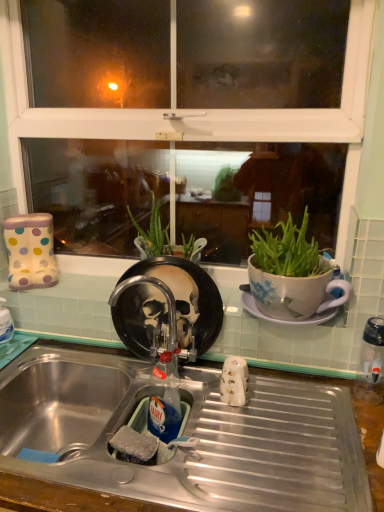
Question: Considering the positions of point (274, 433) and point (160, 397), is point (274, 433) closer or farther from the camera than point (160, 397)?

Choices:
 (A) farther
 (B) closer

Answer: (B)

Question: Looking at their shapes, would you say metallic stainless steel sink at lower center is wider or thinner than translucent plastic bottle at sink?

Choices:
 (A) wide
 (B) thin

Answer: (A)

Question: Considering the real-world distances, which object is closest to the metallic stainless steel sink at lower center?

Choices:
 (A) white ceramic saucer at right
 (B) translucent plastic bottle at sink
 (C) metallic faucet at center
 (D) rubber sponge at sink
 (E) clear plastic water bottle at right

Answer: (B)

Question: Which object is positioned closest to the translucent plastic bottle at sink?

Choices:
 (A) metallic faucet at center
 (B) clear plastic water bottle at right
 (C) metallic stainless steel sink at lower center
 (D) rubber sponge at sink
 (E) white ceramic saucer at right

Answer: (D)